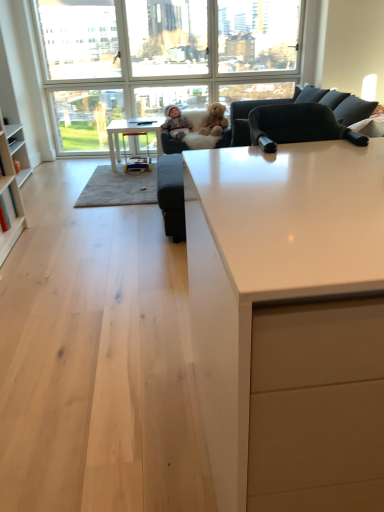
Question: Considering the relative sizes of wooden stool at center and white glossy table at center in the image provided, is wooden stool at center taller than white glossy table at center?

Choices:
 (A) yes
 (B) no

Answer: (B)

Question: Is wooden stool at center outside of white glossy table at center?

Choices:
 (A) no
 (B) yes

Answer: (A)

Question: Is wooden stool at center positioned far away from white glossy table at center?

Choices:
 (A) no
 (B) yes

Answer: (A)

Question: Can you confirm if wooden stool at center is bigger than white glossy table at center?

Choices:
 (A) no
 (B) yes

Answer: (A)

Question: From the image's perspective, does wooden stool at center appear lower than white glossy table at center?

Choices:
 (A) no
 (B) yes

Answer: (B)

Question: Considering the positions of wooden stool at center and matte gray baby at center in the image, is wooden stool at center taller or shorter than matte gray baby at center?

Choices:
 (A) tall
 (B) short

Answer: (A)

Question: In the image, is wooden stool at center positioned in front of or behind matte gray baby at center?

Choices:
 (A) front
 (B) behind

Answer: (A)

Question: From a real-world perspective, is wooden stool at center above or below matte gray baby at center?

Choices:
 (A) below
 (B) above

Answer: (A)

Question: Is point pyautogui.click(x=147, y=135) positioned closer to the camera than point pyautogui.click(x=173, y=120)?

Choices:
 (A) closer
 (B) farther

Answer: (A)

Question: In terms of height, does matte gray baby at center look taller or shorter compared to white glossy countertop at center?

Choices:
 (A) short
 (B) tall

Answer: (A)

Question: From a real-world perspective, is matte gray baby at center physically located above or below white glossy countertop at center?

Choices:
 (A) below
 (B) above

Answer: (B)

Question: Based on their positions, is matte gray baby at center located to the left or right of white glossy countertop at center?

Choices:
 (A) right
 (B) left

Answer: (B)

Question: From the image's perspective, relative to white glossy countertop at center, is matte gray baby at center above or below?

Choices:
 (A) below
 (B) above

Answer: (B)

Question: From a real-world perspective, is white glossy table at center above or below fluffy plush at center?

Choices:
 (A) below
 (B) above

Answer: (A)

Question: Is white glossy table at center in front of or behind fluffy plush at center in the image?

Choices:
 (A) front
 (B) behind

Answer: (A)